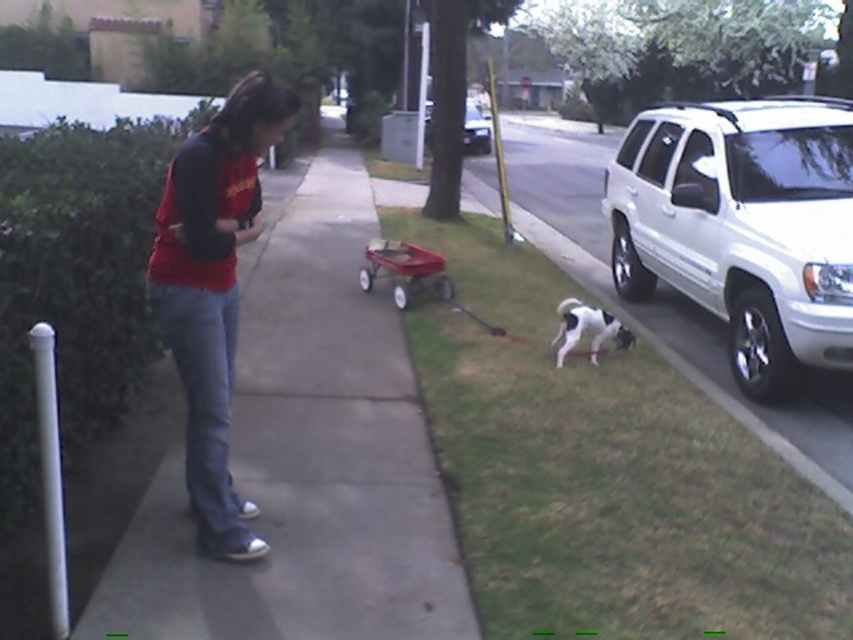
What do you see at coordinates (305, 456) in the screenshot?
I see `smooth concrete sidewalk at center` at bounding box center [305, 456].

Does point (384, 321) lie behind point (482, 141)?

No.

Locate an element on the screen. The width and height of the screenshot is (853, 640). smooth concrete sidewalk at center is located at coordinates (305, 456).

Can you confirm if white and black fur dog at lower right is bigger than white glossy suv at center?

Incorrect, white and black fur dog at lower right is not larger than white glossy suv at center.

Does point (596, 317) lie in front of point (430, 108)?

Yes.

Identify the location of white and black fur dog at lower right. (587, 328).

Does white glossy suv at right have a lesser height compared to white and black fur dog at lower right?

In fact, white glossy suv at right may be taller than white and black fur dog at lower right.

The height and width of the screenshot is (640, 853). Identify the location of white glossy suv at right. (x=743, y=227).

Identify the location of white glossy suv at right. (743, 227).